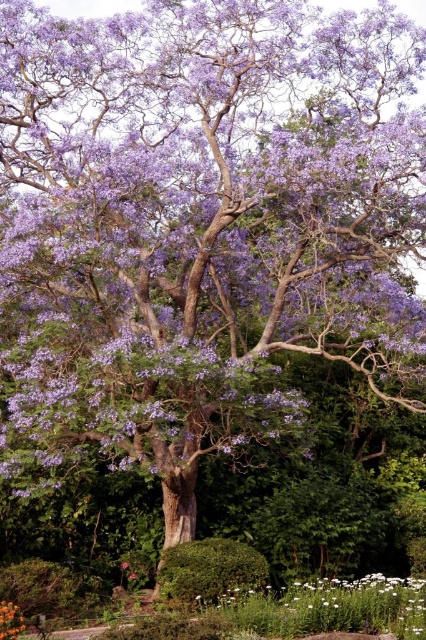
You are standing at the base of the large tree with purple flowers and want to take a photo of the point at coordinates point (360,598). If your camera has a maximum focus range of 30 feet, will you be able to focus on that point?

The distance of point (360,598) from the camera is 34.02 feet, which exceeds the camera maximum focus range of 30 feet. Therefore, you will not be able to focus on that point.

You are a gardener who wants to plant a new flower that requires more sunlight. You notice the white matte flowers at lower right and the orange matte flower at center. Which flower should you place closer to the tree to ensure it gets enough shade?

The white matte flowers at lower right is taller than the orange matte flower at center, so placing the orange matte flower at center closer to the tree would provide it with more shade since it is shorter and less likely to block sunlight from reaching it.

You are standing at the base of the large tree with purple flowers and want to place a small decorative statue exactly at the point marked by coordinates point [334,609]. However, there are already white matte flowers at lower right there. Can you place the statue without disturbing the flowers?

The point [334,609] is occupied by white matte flowers at lower right, so you cannot place the statue there without moving the flowers.